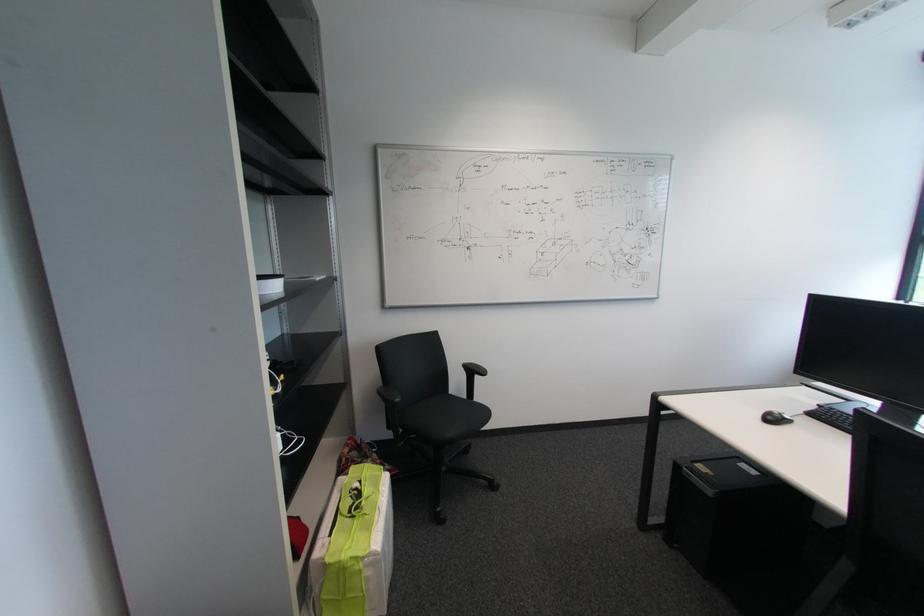
The width and height of the screenshot is (924, 616). Identify the location of white round container. (358, 548).